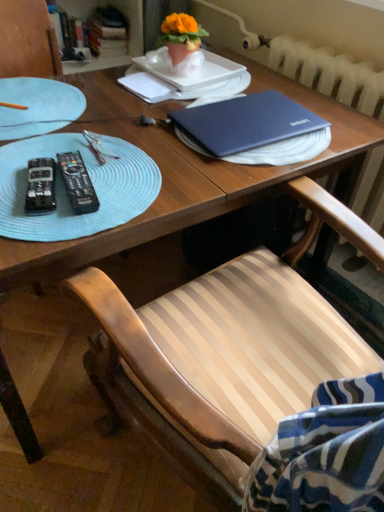
At what (x,y) coordinates should I click in order to perform the action: click on free space that is in between orange matte flower pot at upper center and black plastic remote control at left, which appears as the 1th remote control when viewed from the left. Please return your answer as a coordinate pair (x, y). Looking at the image, I should click on (120, 123).